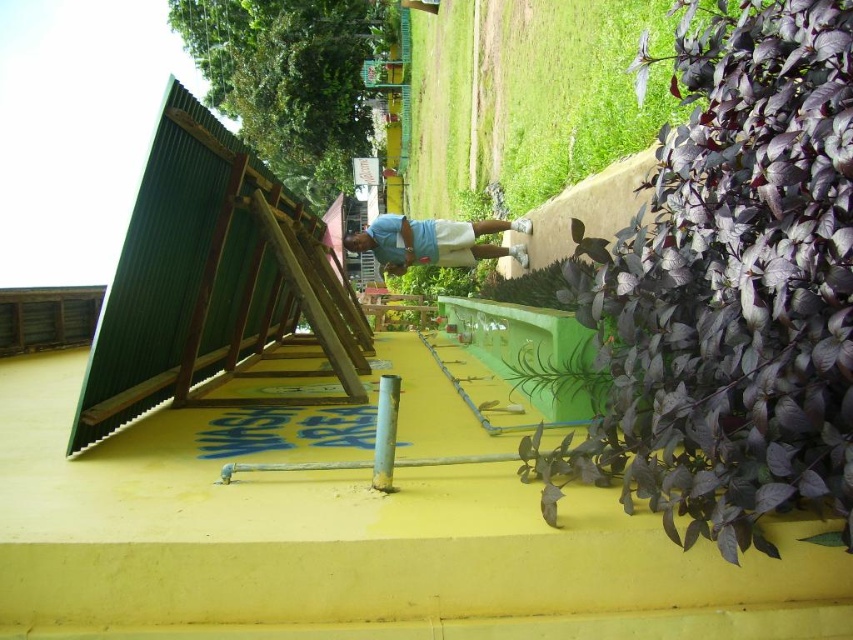
You are standing at the entrance of the WASH AREA and see the light blue fabric at center and the green leafy plant at center. Which object is taller?

The light blue fabric at center is taller than the green leafy plant at center.

You are standing at the entrance of the WASH AREA and see the light blue fabric at center and the green leafy plant at center. Which object takes up more space in the scene?

The light blue fabric at center is bigger than the green leafy plant at center, so it takes up more space in the scene.

You are standing in front of the WASH AREA and notice two plants nearby. The purple matte leaves at upper right and the green leafy plant at center. Which one has a wider spread?

The purple matte leaves at upper right has a wider spread than the green leafy plant at center.